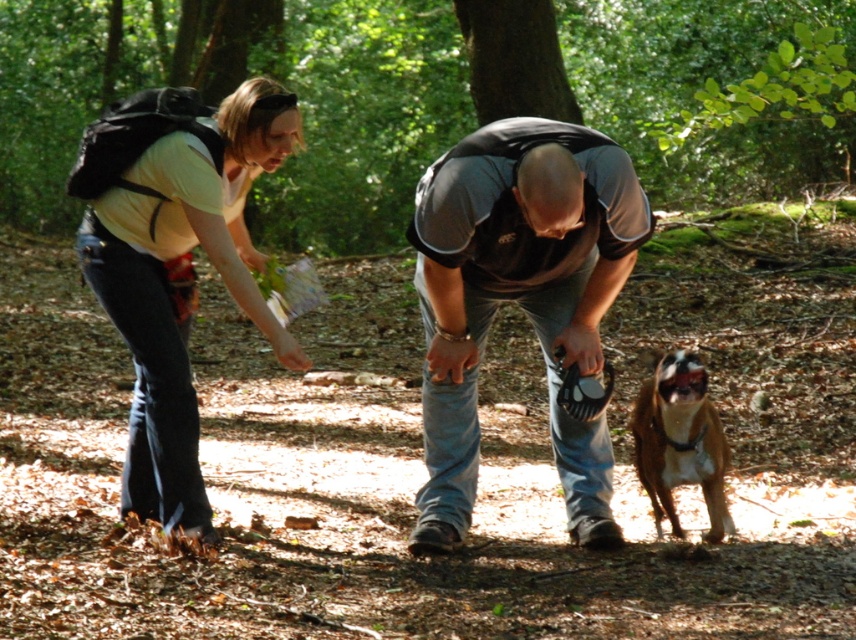
Find the location of a particular element. The width and height of the screenshot is (856, 640). dark gray mesh shirt at center is located at coordinates (520, 300).

Which is above, dark gray mesh shirt at center or matte yellow shirt at center?

matte yellow shirt at center is above.

At what (x,y) coordinates should I click in order to perform the action: click on dark gray mesh shirt at center. Please return your answer as a coordinate pair (x, y). The image size is (856, 640). Looking at the image, I should click on (520, 300).

Who is more forward, (186,442) or (642,403)?

Point (186,442) is in front.

Between matte yellow shirt at center and brown fur dog at lower right, which one is positioned lower?

Positioned lower is brown fur dog at lower right.

Does point (143, 436) come closer to viewer compared to point (645, 477)?

That is False.

Locate an element on the screen. The width and height of the screenshot is (856, 640). matte yellow shirt at center is located at coordinates (175, 260).

Does dark gray mesh shirt at center appear on the left side of brown fur dog at lower right?

Correct, you'll find dark gray mesh shirt at center to the left of brown fur dog at lower right.

You are a GUI agent. You are given a task and a screenshot of the screen. Output one action in this format:
    pyautogui.click(x=<x>, y=<y>)
    Task: Click on the dark gray mesh shirt at center
    
    Given the screenshot: What is the action you would take?
    pyautogui.click(x=520, y=300)

In order to click on dark gray mesh shirt at center in this screenshot , I will do `click(520, 300)`.